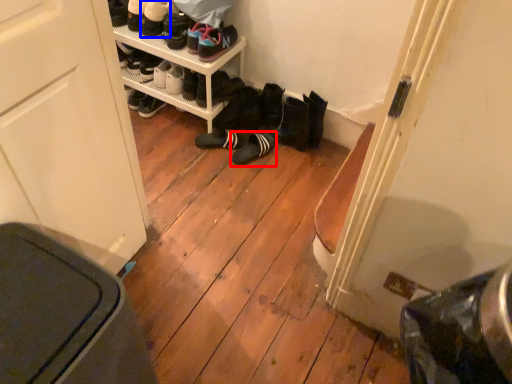
Question: Which object appears closest to the camera in this image, footwear (highlighted by a red box) or footwear (highlighted by a blue box)?

Choices:
 (A) footwear
 (B) footwear

Answer: (B)